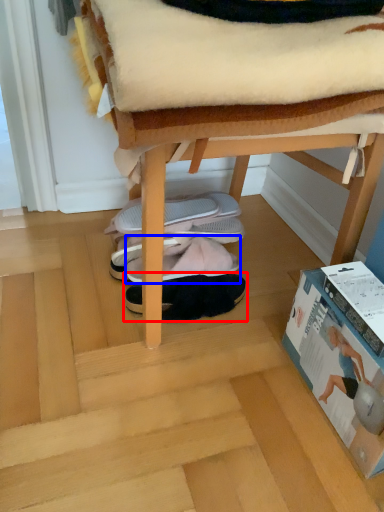
Question: Which point is closer to the camera, footwear (highlighted by a red box) or footwear (highlighted by a blue box)?

Choices:
 (A) footwear
 (B) footwear

Answer: (A)